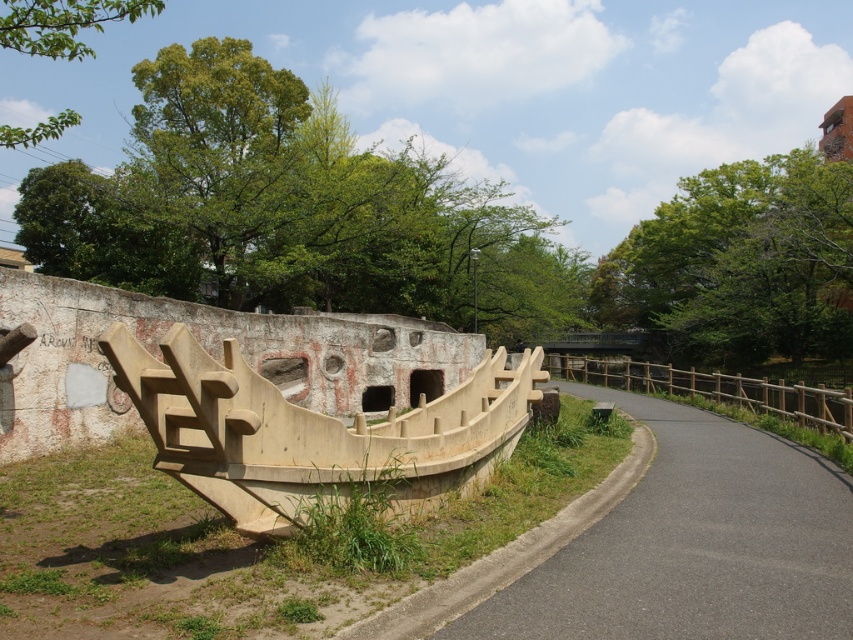
Can you confirm if asphalt road at center is positioned above beige concrete boat at center?

Actually, asphalt road at center is below beige concrete boat at center.

Does asphalt road at center appear on the left side of beige concrete boat at center?

Incorrect, asphalt road at center is not on the left side of beige concrete boat at center.

Who is more distant from viewer, (x=631, y=403) or (x=196, y=449)?

The point (x=631, y=403) is behind.

Where is `asphalt road at center`? The height and width of the screenshot is (640, 853). asphalt road at center is located at coordinates (694, 545).